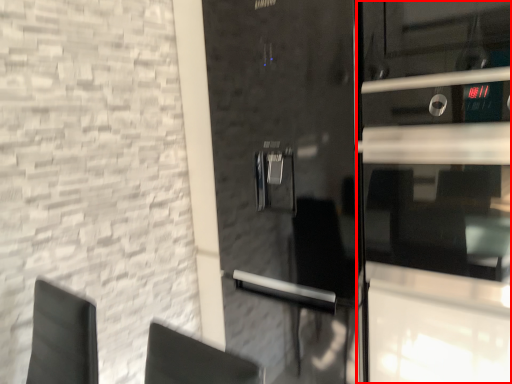
Question: From the image's perspective, considering the relative positions of glass door (annotated by the red box) and door in the image provided, where is glass door (annotated by the red box) located with respect to the staircase?

Choices:
 (A) above
 (B) below

Answer: (A)